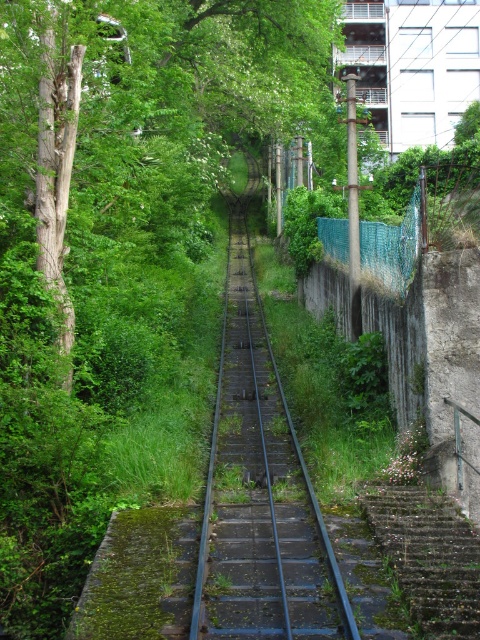
Question: Which object appears closest to the camera in this image?

Choices:
 (A) mossy concrete stairs at lower right
 (B) rusty metal train track at center

Answer: (A)

Question: Does green leafy tree at upper left have a greater width compared to rusty metal train track at center?

Choices:
 (A) yes
 (B) no

Answer: (A)

Question: Which of these objects is positioned farthest from the rusty metal train track at center?

Choices:
 (A) green leafy tree at upper left
 (B) mossy concrete stairs at lower right

Answer: (A)

Question: From the image, what is the correct spatial relationship of green leafy tree at upper left in relation to rusty metal train track at center?

Choices:
 (A) below
 (B) above

Answer: (B)

Question: Which point appears closest to the camera in this image?

Choices:
 (A) (259, 365)
 (B) (445, 532)
 (C) (322, 20)

Answer: (B)

Question: Where is rusty metal train track at center located in relation to mossy concrete stairs at lower right in the image?

Choices:
 (A) left
 (B) right

Answer: (A)